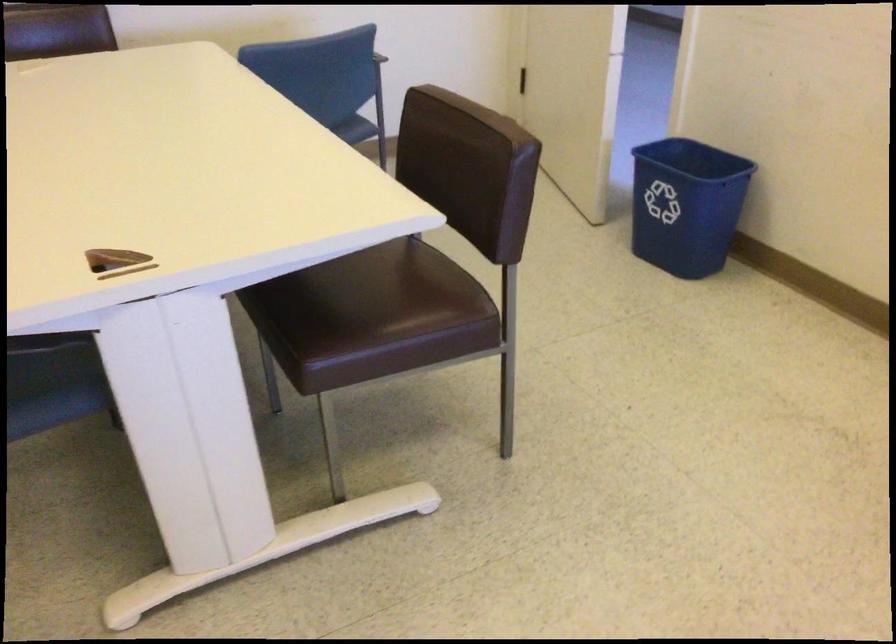
The height and width of the screenshot is (644, 896). What do you see at coordinates (392, 135) in the screenshot? I see `the blue chair sitting surface` at bounding box center [392, 135].